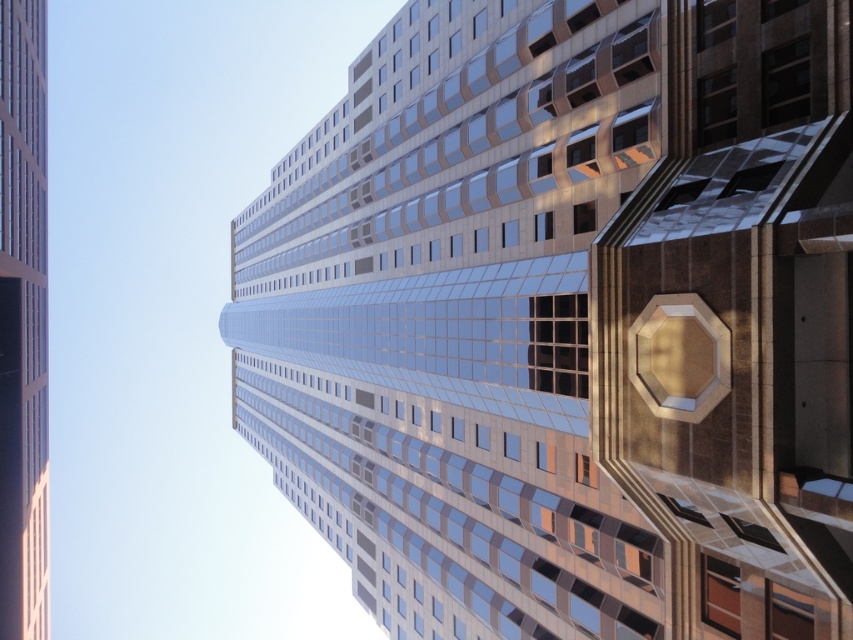
Question: Is glossy glass tower at center smaller than glassy reflective skyscraper at center?

Choices:
 (A) no
 (B) yes

Answer: (A)

Question: Which point appears farthest from the camera in this image?

Choices:
 (A) (4, 364)
 (B) (440, 314)

Answer: (A)

Question: Is glossy glass tower at center to the right of glassy reflective skyscraper at center from the viewer's perspective?

Choices:
 (A) yes
 (B) no

Answer: (A)

Question: Which point is farther to the camera?

Choices:
 (A) glassy reflective skyscraper at center
 (B) glossy glass tower at center

Answer: (A)

Question: Is glossy glass tower at center positioned before glassy reflective skyscraper at center?

Choices:
 (A) yes
 (B) no

Answer: (A)